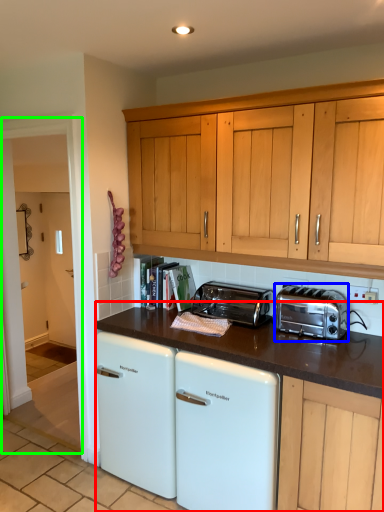
Question: Estimate the real-world distances between objects in this image. Which object is farther from appliance (highlighted by a red box), toaster (highlighted by a blue box) or glass door (highlighted by a green box)?

Choices:
 (A) toaster
 (B) glass door

Answer: (B)